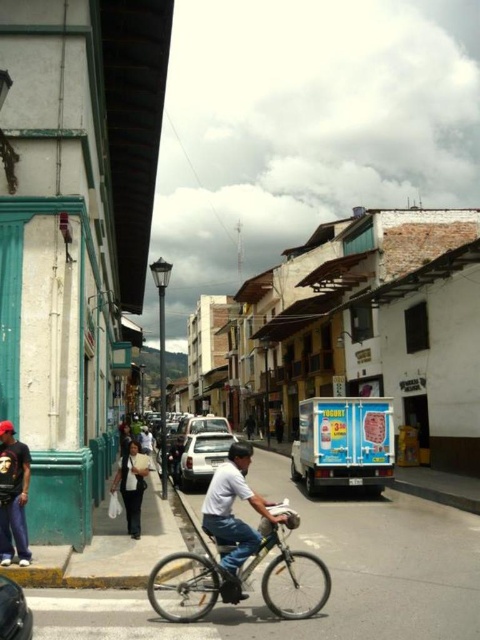
Question: Which of the following is the closest to the observer?

Choices:
 (A) silver metallic bicycle at center
 (B) dark blue jeans at lower left
 (C) denim jeans at center
 (D) shiny black car at lower left

Answer: (D)

Question: Which point appears closest to the camera in this image?

Choices:
 (A) (212, 452)
 (B) (14, 589)

Answer: (B)

Question: From the image, what is the correct spatial relationship of silver metallic bicycle at center in relation to white matte car at center?

Choices:
 (A) above
 (B) below

Answer: (A)

Question: Does silver metallic bicycle at center have a larger size compared to denim jeans at center?

Choices:
 (A) yes
 (B) no

Answer: (B)

Question: Which object is positioned farthest from the shiny black car at lower left?

Choices:
 (A) silver metallic bicycle at center
 (B) dark blue jeans at lower left
 (C) denim jeans at center
 (D) white matte car at center

Answer: (D)

Question: Does silver metallic bicycle at center appear under white matte car at center?

Choices:
 (A) yes
 (B) no

Answer: (B)